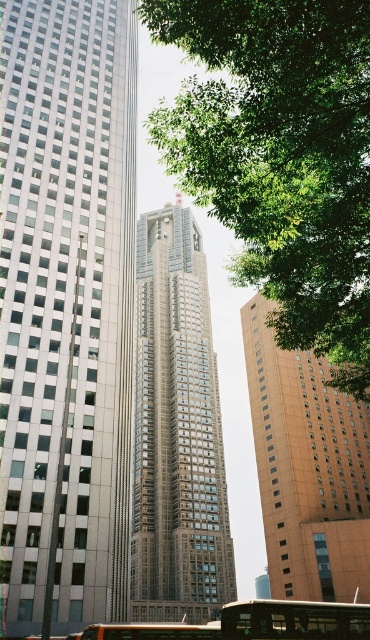
Does orange brick building at center have a larger size compared to metallic silver bus at center?

Yes.

Is point (364, 506) positioned before point (116, 628)?

No, it is behind (116, 628).

In order to click on orange brick building at center in this screenshot , I will do (307, 467).

In the scene shown: Does orange brick building at center appear on the right side of brown wooden tour bus at center?

Correct, you'll find orange brick building at center to the right of brown wooden tour bus at center.

Between point (264, 452) and point (317, 621), which one is positioned behind?

The point (264, 452) is more distant.

Locate an element on the screen. This screenshot has width=370, height=640. orange brick building at center is located at coordinates (307, 467).

Can you confirm if silver metallic skyscraper at left is positioned to the right of brown wooden tour bus at center?

No, silver metallic skyscraper at left is not to the right of brown wooden tour bus at center.

Find the location of a particular element. The width and height of the screenshot is (370, 640). silver metallic skyscraper at left is located at coordinates (66, 307).

Locate an element on the screen. This screenshot has width=370, height=640. silver metallic skyscraper at left is located at coordinates (66, 307).

Identify the location of silver metallic skyscraper at left. The width and height of the screenshot is (370, 640). (66, 307).